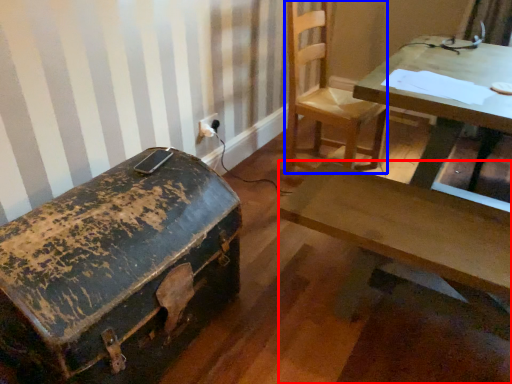
Question: Which object is further to the camera taking this photo, desk (highlighted by a red box) or chair (highlighted by a blue box)?

Choices:
 (A) desk
 (B) chair

Answer: (B)